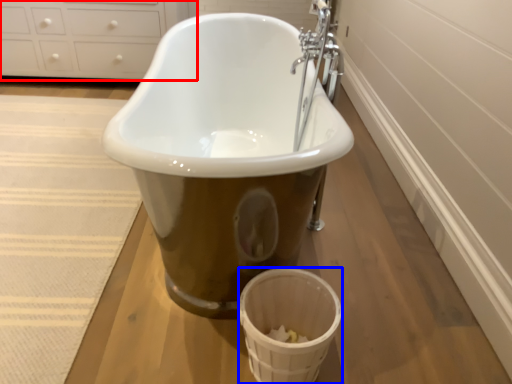
Question: Which of the following is the closest to the observer, cabinetry (highlighted by a red box) or basket (highlighted by a blue box)?

Choices:
 (A) cabinetry
 (B) basket

Answer: (B)